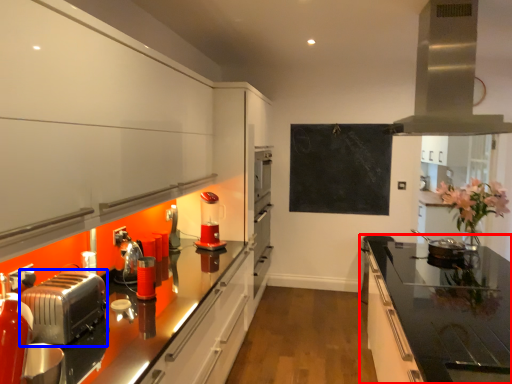
Question: Which of the following is the closest to the observer, countertop (highlighted by a red box) or toaster (highlighted by a blue box)?

Choices:
 (A) countertop
 (B) toaster

Answer: (A)